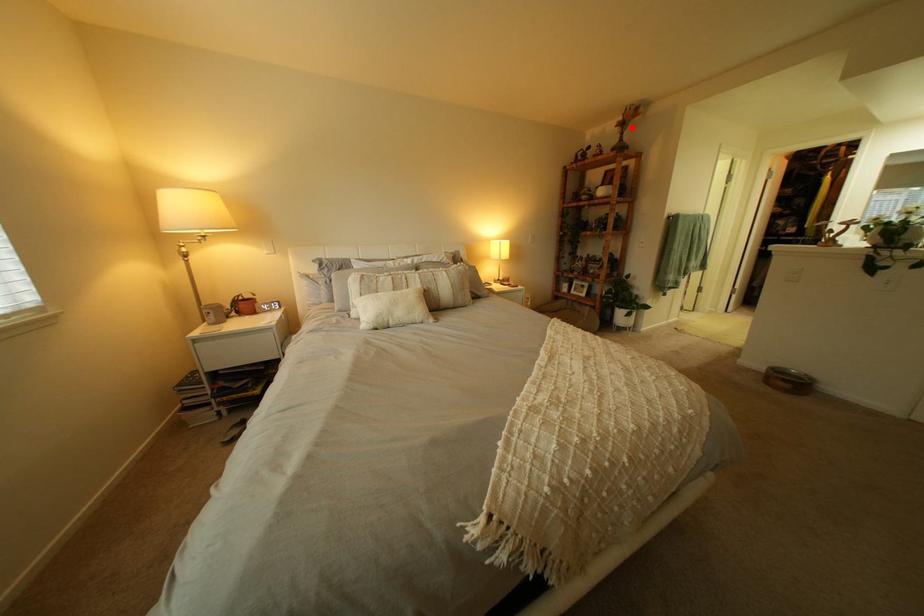
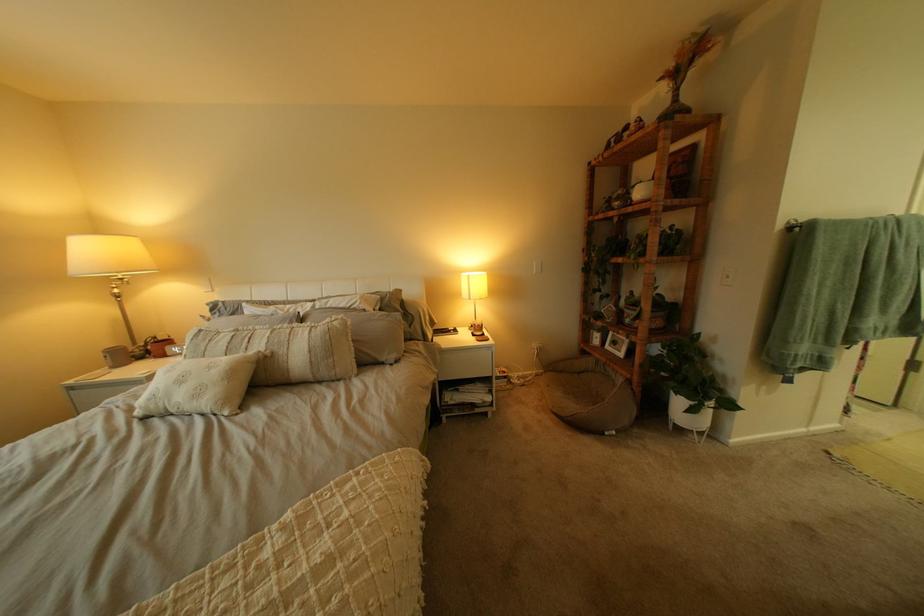
Where in the second image is the point corresponding to the highlighted location from the first image?

(675, 81)